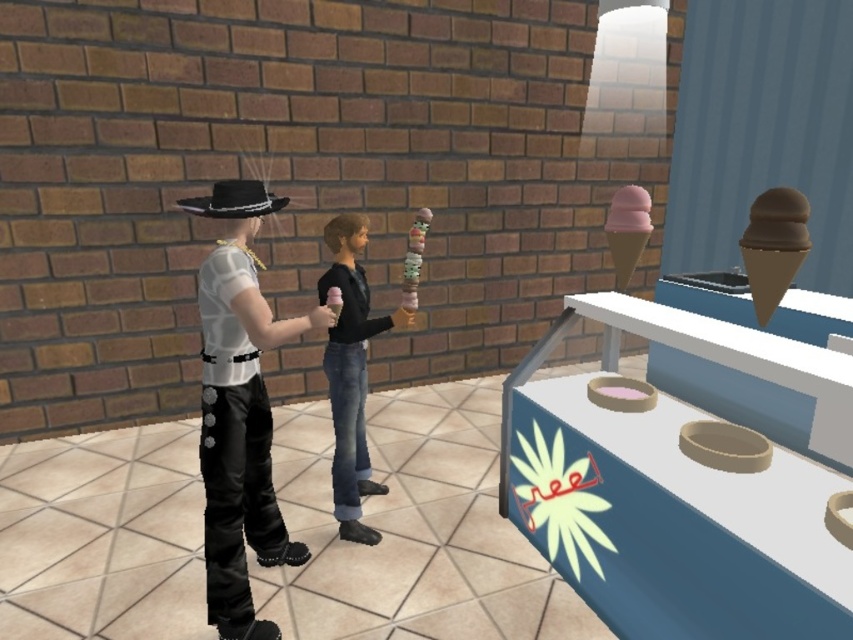
Does jeans at center appear on the left side of multicolored candy at center?

Yes, jeans at center is to the left of multicolored candy at center.

Is point (339, 264) positioned behind point (412, 241)?

No, (339, 264) is closer to viewer.

This screenshot has width=853, height=640. What are the coordinates of `jeans at center` in the screenshot? It's located at (351, 372).

Is pink matte ice cream cone at upper right below pink matte ice cream cone at center?

No, pink matte ice cream cone at upper right is not below pink matte ice cream cone at center.

Is point (643, 196) positioned in front of point (329, 292)?

That is True.

At what (x,y) coordinates should I click in order to perform the action: click on pink matte ice cream cone at upper right. Please return your answer as a coordinate pair (x, y). Image resolution: width=853 pixels, height=640 pixels. Looking at the image, I should click on (627, 230).

The width and height of the screenshot is (853, 640). In order to click on leather pants at left in this screenshot , I will do `click(239, 408)`.

Does leather pants at left have a greater height compared to pink matte ice cream cone at center?

Yes, leather pants at left is taller than pink matte ice cream cone at center.

Who is more distant from viewer, [262,408] or [328,296]?

The point [328,296] is behind.

Where is `leather pants at left`? The height and width of the screenshot is (640, 853). leather pants at left is located at coordinates (239, 408).